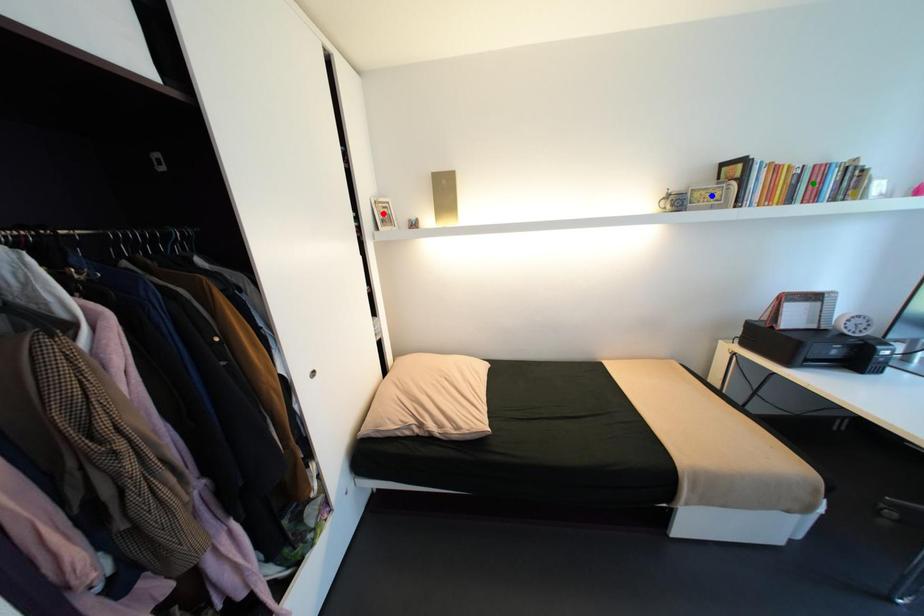
Order these from nearest to farthest:
green point
red point
blue point

green point
blue point
red point